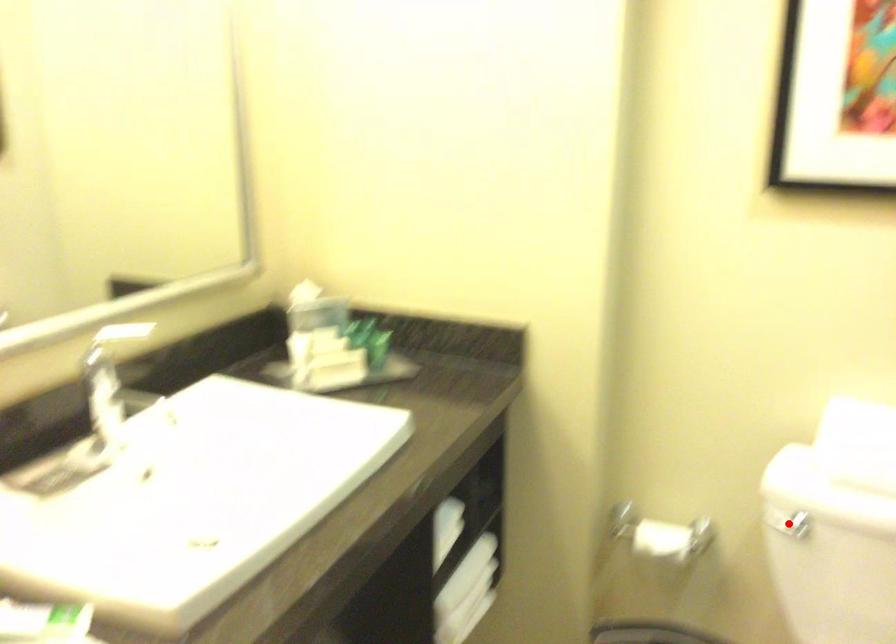
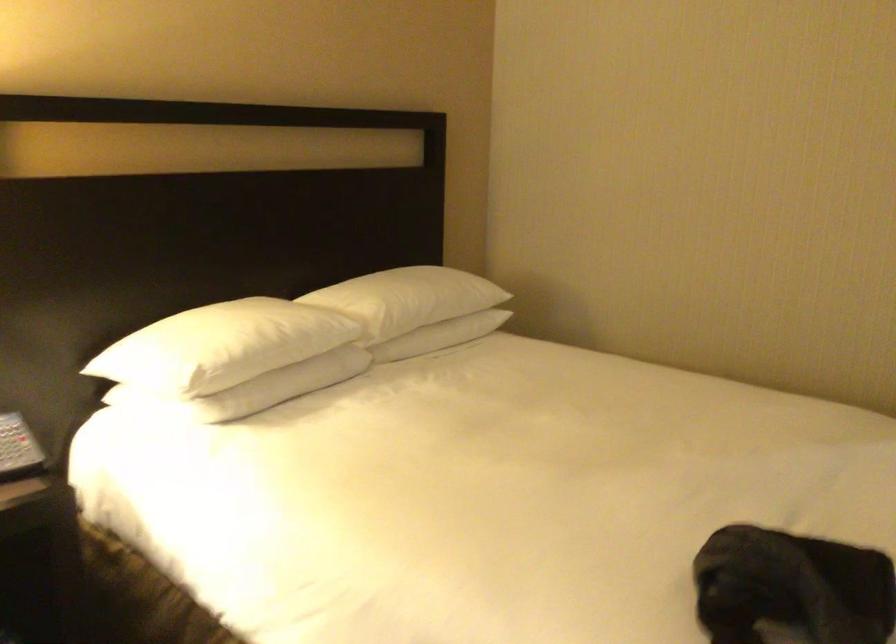
Question: I am providing you with two images of the same scene from different viewpoints. A red point is marked on the first image. At the location where the point appears in image 1, is it still visible in image 2?

Choices:
 (A) Yes
 (B) No

Answer: (B)